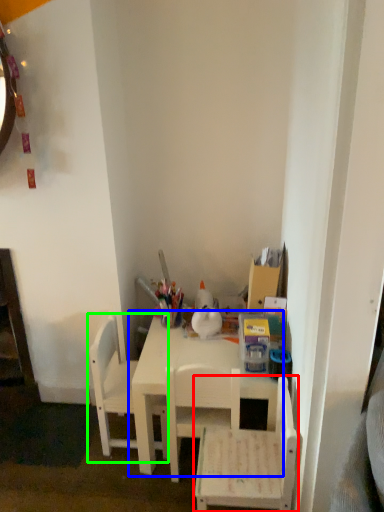
Question: Which is nearer to the chair (highlighted by a red box)? table (highlighted by a blue box) or chair (highlighted by a green box).

Choices:
 (A) table
 (B) chair

Answer: (A)